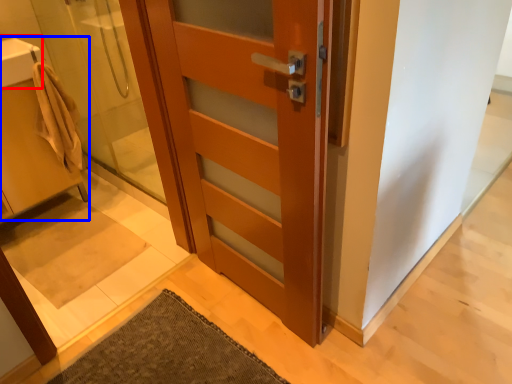
Question: Among these objects, which one is nearest to the camera, sink (highlighted by a red box) or sink (highlighted by a blue box)?

Choices:
 (A) sink
 (B) sink

Answer: (B)